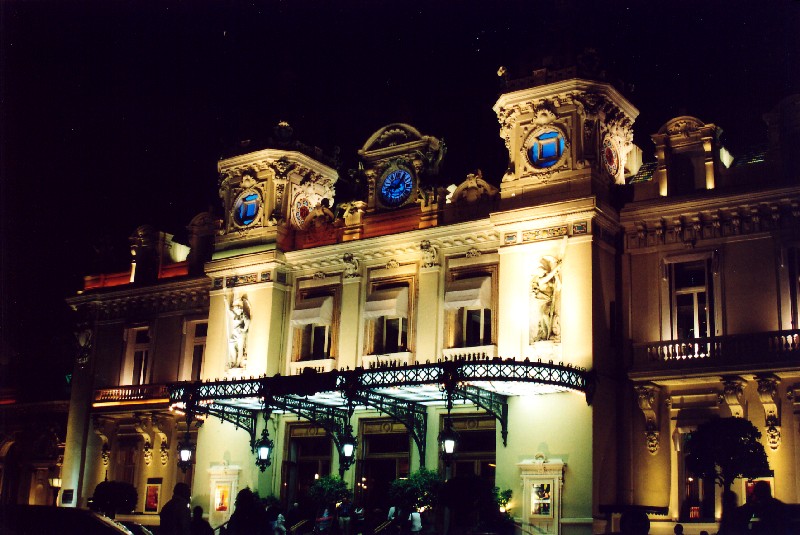
Where is `metal support unit`? The image size is (800, 535). metal support unit is located at coordinates (480, 395), (390, 403), (304, 408), (226, 414).